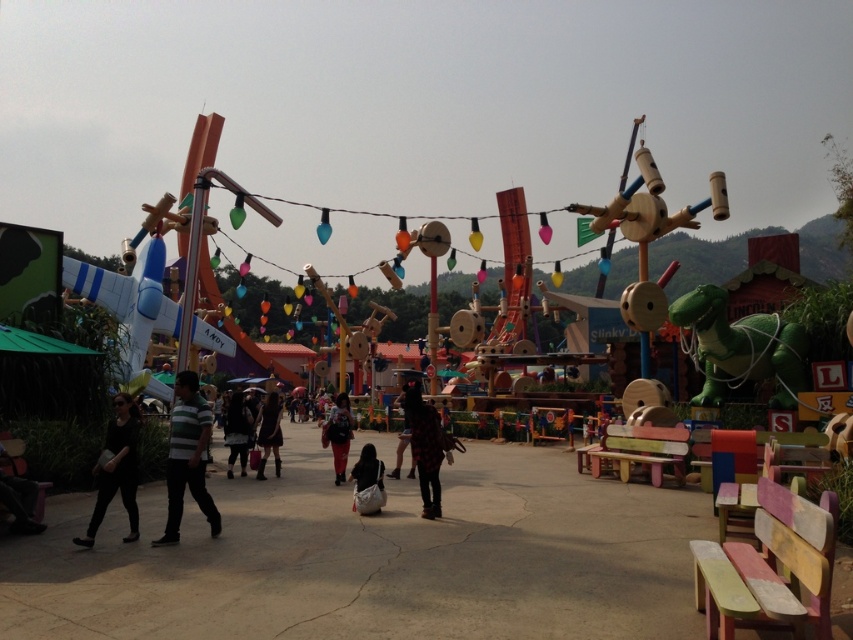
Which is in front, point (134, 477) or point (380, 506)?

Positioned in front is point (134, 477).

Between black matte pants at lower left and black matte bag at center, which one is positioned lower?

black matte bag at center is lower down.

Measure the distance between black matte pants at lower left and camera.

7.36 meters

The height and width of the screenshot is (640, 853). I want to click on black matte pants at lower left, so click(115, 468).

Which is below, green rubber dinosaur at right or dark gray fabric coat at center?

Positioned lower is dark gray fabric coat at center.

Describe the element at coordinates (740, 348) in the screenshot. I see `green rubber dinosaur at right` at that location.

Between point (711, 323) and point (233, 422), which one is positioned behind?

Point (711, 323)

What are the coordinates of `green rubber dinosaur at right` in the screenshot? It's located at (740, 348).

Is green rubber dinosaur at right to the left of dark gray fabric dress at center from the viewer's perspective?

Incorrect, green rubber dinosaur at right is not on the left side of dark gray fabric dress at center.

Between green rubber dinosaur at right and dark gray fabric dress at center, which one is positioned higher?

green rubber dinosaur at right is above.

Image resolution: width=853 pixels, height=640 pixels. Identify the location of green rubber dinosaur at right. click(740, 348).